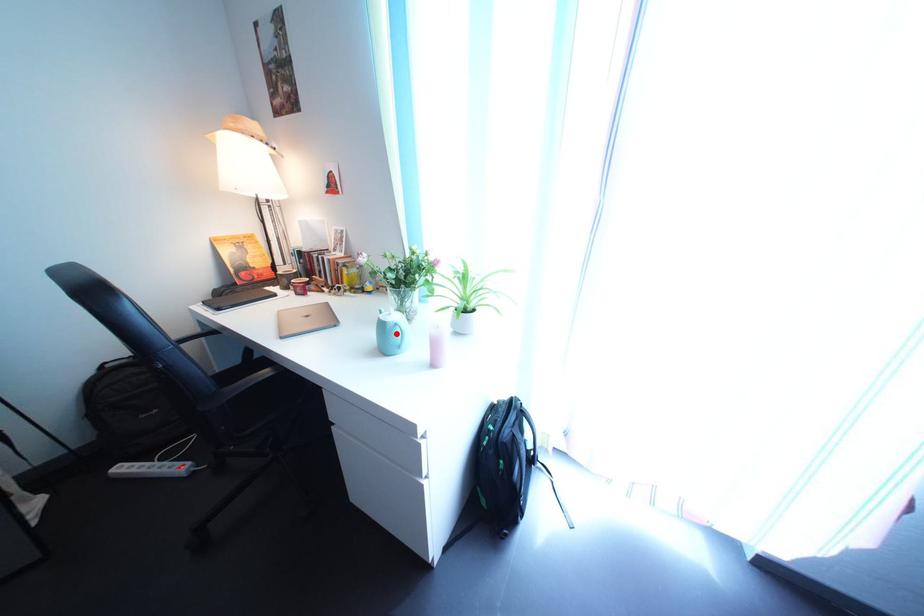
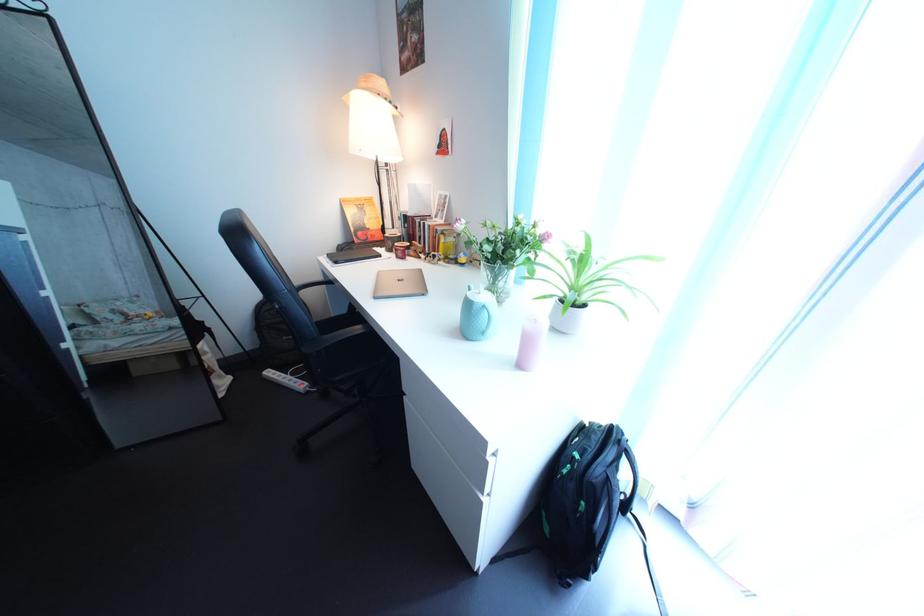
Where in the second image is the point corresponding to the highlighted location from the first image?

(482, 313)